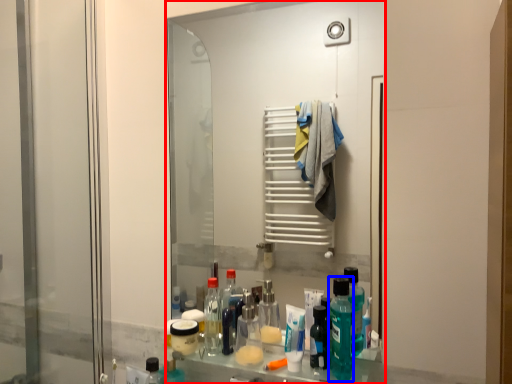
Question: Which object appears farthest to the camera in this image, mirror (highlighted by a red box) or cleaning product (highlighted by a blue box)?

Choices:
 (A) mirror
 (B) cleaning product

Answer: (A)